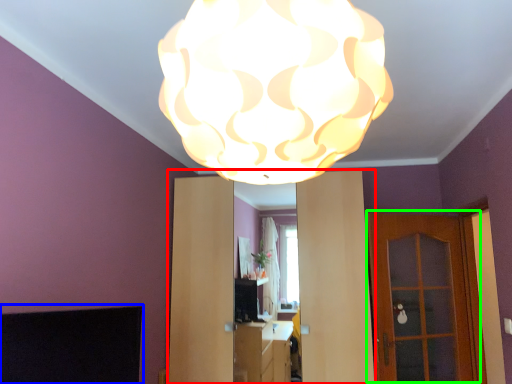
Question: Estimate the real-world distances between objects in this image. Which object is farther from dresser (highlighted by a red box), fireplace (highlighted by a blue box) or door (highlighted by a green box)?

Choices:
 (A) fireplace
 (B) door

Answer: (A)